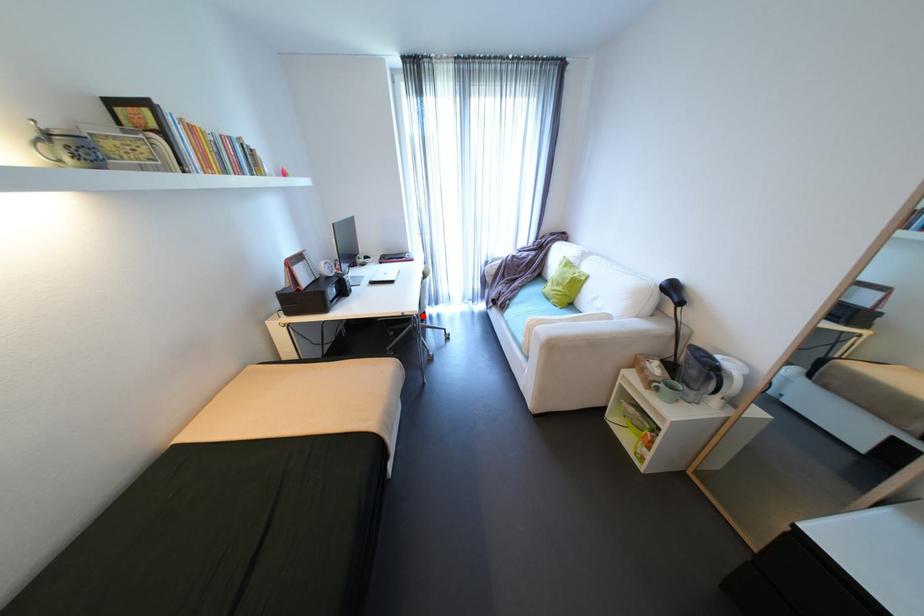
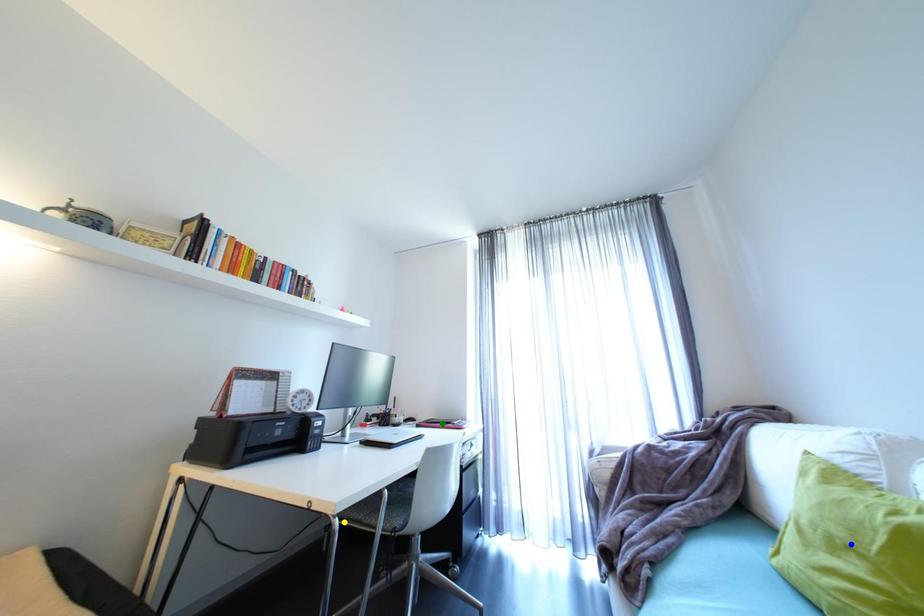
Question: I am providing you with two images of the same scene from different viewpoints. A red point is marked on the first image. You are given multiple points on the second image. Which spot in image 2 lines up with the point in image 1?

Choices:
 (A) blue point
 (B) yellow point
 (C) green point

Answer: (B)